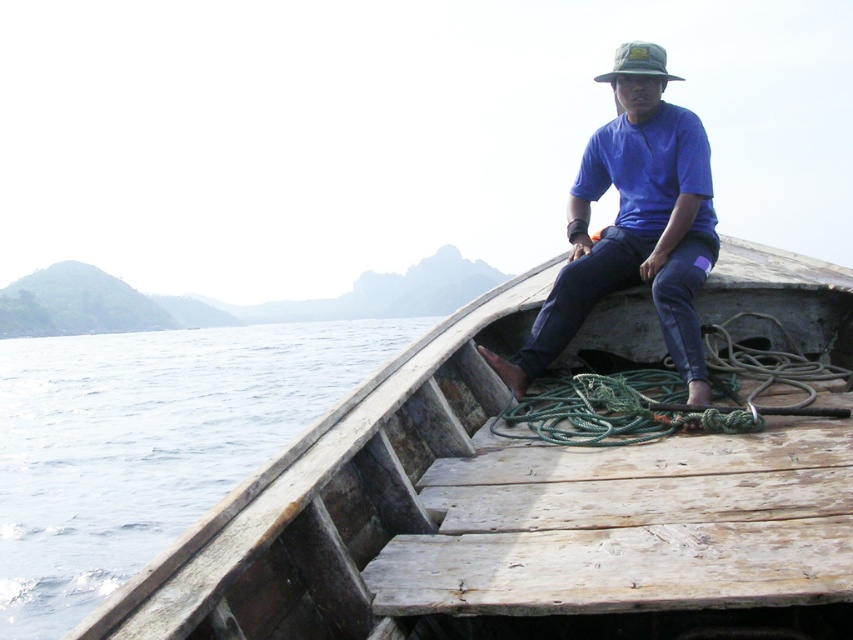
Is point (59, 419) farther from camera compared to point (677, 289)?

Yes, point (59, 419) is farther from viewer.

Is point (180, 492) positioned after point (688, 115)?

Yes, point (180, 492) is farther from viewer.

The height and width of the screenshot is (640, 853). What are the coordinates of `clear blue water at lower left` in the screenshot? It's located at (148, 444).

Measure the distance from green rope at center to green fabric hat at upper center.

The distance of green rope at center from green fabric hat at upper center is 7.02 feet.

Does green rope at center have a lesser width compared to green fabric hat at upper center?

Yes.

Is point (534, 412) farther from camera compared to point (666, 80)?

No, (534, 412) is in front of (666, 80).

The height and width of the screenshot is (640, 853). What are the coordinates of `green rope at center` in the screenshot? It's located at (666, 396).

Can you confirm if wooden boat at center is positioned below clear blue water at lower left?

No, wooden boat at center is not below clear blue water at lower left.

Based on the photo, measure the distance between wooden boat at center and camera.

wooden boat at center is 1.66 meters from camera.

This screenshot has height=640, width=853. Describe the element at coordinates (500, 516) in the screenshot. I see `wooden boat at center` at that location.

Locate an element on the screen. This screenshot has width=853, height=640. wooden boat at center is located at coordinates (500, 516).